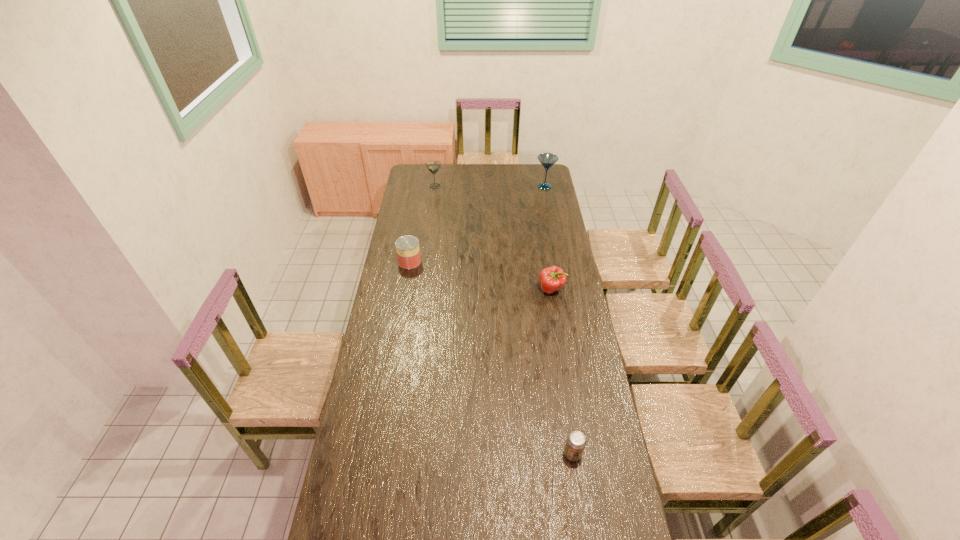
Find the location of a particular element. This screenshot has height=540, width=960. vacant space at the right edge of the desktop is located at coordinates (537, 224).

Identify the location of vacant space in between the right martini and the can. (477, 224).

You are a GUI agent. You are given a task and a screenshot of the screen. Output one action in this format:
    pyautogui.click(x=<x>, y=<y>)
    Task: Click on the vacant area that lies between the right martini and the nearest object
    The image size is (960, 540).
    Given the screenshot: What is the action you would take?
    pyautogui.click(x=559, y=320)

Image resolution: width=960 pixels, height=540 pixels. Identify the location of unoccupied area between the pepper and the nearest object. (x=562, y=372).

This screenshot has width=960, height=540. I want to click on vacant space that's between the fourth farthest object and the shorter martini, so click(493, 238).

You are a GUI agent. You are given a task and a screenshot of the screen. Output one action in this format:
    pyautogui.click(x=<x>, y=<y>)
    Task: Click on the free space between the can and the left martini
    The image size is (960, 540).
    Given the screenshot: What is the action you would take?
    pyautogui.click(x=422, y=224)

This screenshot has width=960, height=540. I want to click on free space between the right martini and the third farthest object, so click(477, 224).

This screenshot has width=960, height=540. I want to click on vacant space in between the beer can and the can, so click(492, 357).

This screenshot has width=960, height=540. In order to click on free space between the left martini and the right martini in this screenshot , I will do `click(490, 186)`.

The image size is (960, 540). I want to click on empty location between the right martini and the pepper, so click(548, 238).